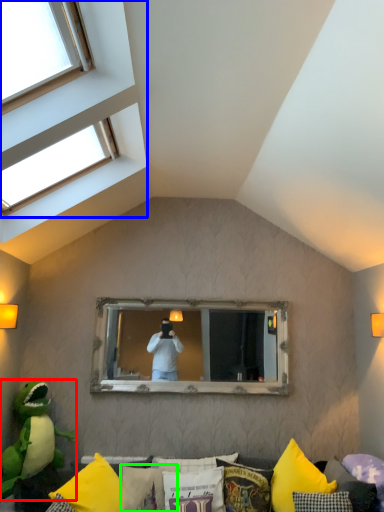
Question: Considering the real-world distances, which object is closest to parrot (highlighted by a red box)? window (highlighted by a blue box) or pillow (highlighted by a green box).

Choices:
 (A) window
 (B) pillow

Answer: (B)